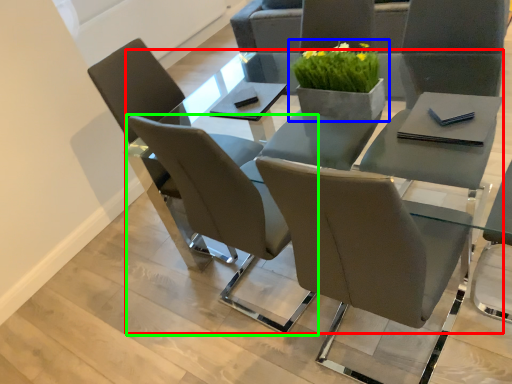
Question: Considering the real-world distances, which object is farthest from round table (highlighted by a red box)? houseplant (highlighted by a blue box) or chair (highlighted by a green box)?

Choices:
 (A) houseplant
 (B) chair

Answer: (B)